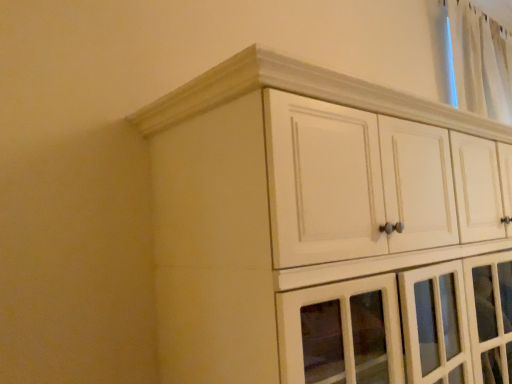
Question: Is white wood cupboard at upper center bigger than white sheer curtain at upper right?

Choices:
 (A) yes
 (B) no

Answer: (A)

Question: From a real-world perspective, is white wood cupboard at upper center physically above white sheer curtain at upper right?

Choices:
 (A) yes
 (B) no

Answer: (B)

Question: Can you confirm if white wood cupboard at upper center is positioned to the left of white sheer curtain at upper right?

Choices:
 (A) no
 (B) yes

Answer: (B)

Question: From the image's perspective, is white wood cupboard at upper center on top of white sheer curtain at upper right?

Choices:
 (A) no
 (B) yes

Answer: (A)

Question: Does white wood cupboard at upper center come behind white sheer curtain at upper right?

Choices:
 (A) no
 (B) yes

Answer: (A)

Question: Are white wood cupboard at upper center and white sheer curtain at upper right located far from each other?

Choices:
 (A) yes
 (B) no

Answer: (A)

Question: Does white sheer curtain at upper right lie in front of white wood cupboard at upper center?

Choices:
 (A) no
 (B) yes

Answer: (A)

Question: Is white sheer curtain at upper right positioned with its back to white wood cupboard at upper center?

Choices:
 (A) no
 (B) yes

Answer: (A)

Question: From a real-world perspective, is white sheer curtain at upper right physically above white wood cupboard at upper center?

Choices:
 (A) yes
 (B) no

Answer: (A)

Question: Does white sheer curtain at upper right have a lesser height compared to white wood cupboard at upper center?

Choices:
 (A) yes
 (B) no

Answer: (A)

Question: From the image's perspective, is white sheer curtain at upper right located beneath white wood cupboard at upper center?

Choices:
 (A) yes
 (B) no

Answer: (B)

Question: Considering the relative sizes of white sheer curtain at upper right and white wood cupboard at upper center in the image provided, is white sheer curtain at upper right thinner than white wood cupboard at upper center?

Choices:
 (A) no
 (B) yes

Answer: (B)

Question: From the image's perspective, is white sheer curtain at upper right located above or below white wood cupboard at upper center?

Choices:
 (A) above
 (B) below

Answer: (A)